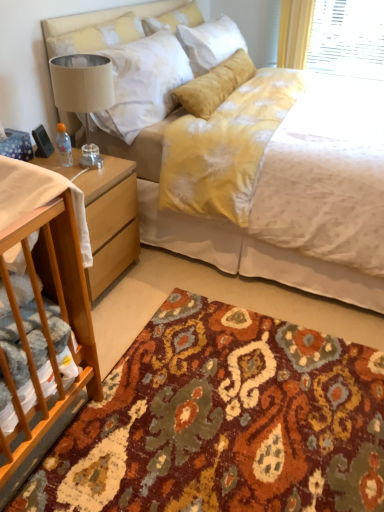
Find the location of a particular element. The image size is (384, 512). free spot below beige fabric lampshade at left (from a real-world perspective) is located at coordinates (87, 162).